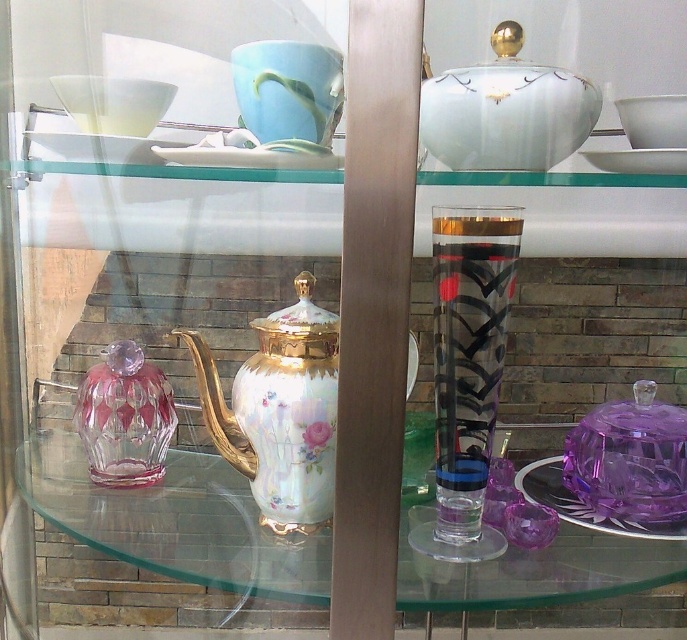
You are a museum curator arranging items in the display cabinet. You need to place a new item at point (280, 410). Is there already an item at that location?

Yes, there is already a porcelain hand painted teapot at center located at point (280, 410).